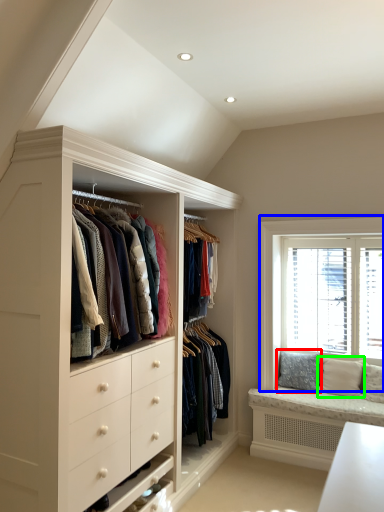
Question: Estimate the real-world distances between objects in this image. Which object is closer to pillow (highlighted by a red box), window (highlighted by a blue box) or pillow (highlighted by a green box)?

Choices:
 (A) window
 (B) pillow

Answer: (B)